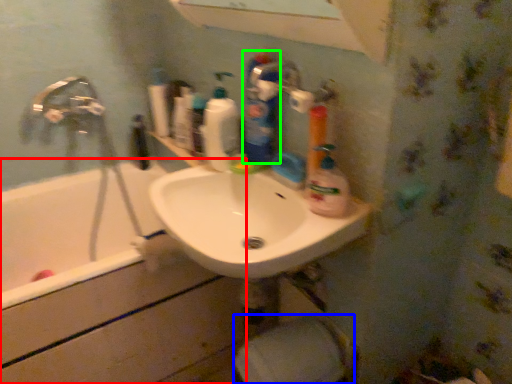
Question: Estimate the real-world distances between objects in this image. Which object is farther from bath (highlighted by a red box), toilet paper (highlighted by a blue box) or cleaning product (highlighted by a green box)?

Choices:
 (A) toilet paper
 (B) cleaning product

Answer: (B)